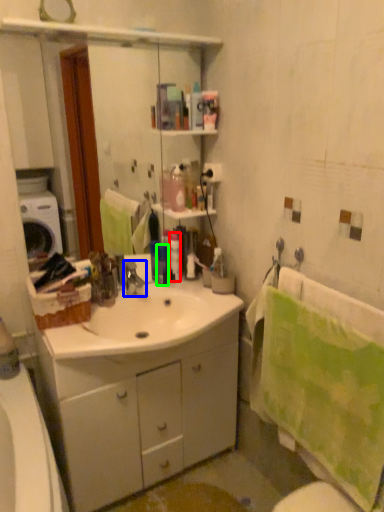
Question: Estimate the real-world distances between objects in this image. Which object is closer to toiletry (highlighted by a red box), tap (highlighted by a blue box) or toiletry (highlighted by a green box)?

Choices:
 (A) tap
 (B) toiletry

Answer: (B)